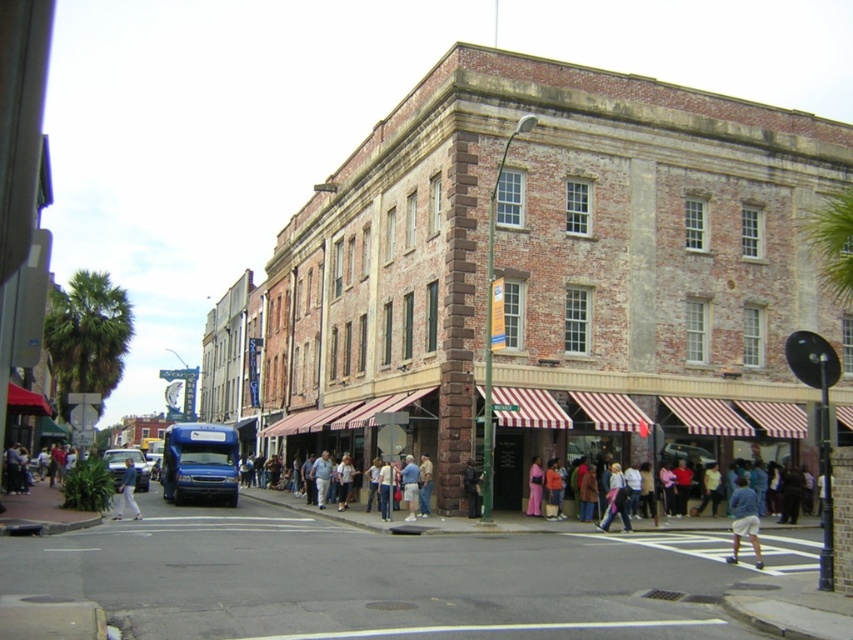
You are a GUI agent. You are given a task and a screenshot of the screen. Output one action in this format:
    pyautogui.click(x=<x>, y=<y>)
    Task: Click on the blue denim shorts at lower right
    The image size is (853, 640).
    Given the screenshot: What is the action you would take?
    pyautogui.click(x=744, y=518)

Does point (734, 490) come farther from viewer compared to point (618, 490)?

That is True.

This screenshot has width=853, height=640. Describe the element at coordinates (744, 518) in the screenshot. I see `blue denim shorts at lower right` at that location.

Where is `blue denim shorts at lower right`? blue denim shorts at lower right is located at coordinates (744, 518).

Does point (759, 554) come closer to viewer compared to point (416, 484)?

Yes, it is in front of point (416, 484).

Can you confirm if blue denim shorts at lower right is thinner than denim jacket at lower center?

No.

What do you see at coordinates (744, 518) in the screenshot?
I see `blue denim shorts at lower right` at bounding box center [744, 518].

At what (x,y) coordinates should I click in order to perform the action: click on blue denim shorts at lower right. Please return your answer as a coordinate pair (x, y). Image resolution: width=853 pixels, height=640 pixels. Looking at the image, I should click on (744, 518).

Which of these two, light blue jeans at lower center or denim jacket at lower center, stands shorter?

light blue jeans at lower center

Does light blue jeans at lower center have a lesser height compared to denim jacket at lower center?

Indeed, light blue jeans at lower center has a lesser height compared to denim jacket at lower center.

Is point (613, 502) behind point (410, 516)?

No.

In order to click on light blue jeans at lower center in this screenshot , I will do `click(616, 499)`.